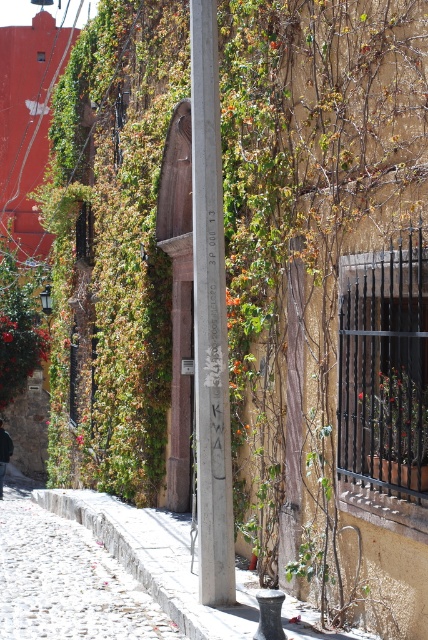
Can you confirm if white cobblestone at lower left is taller than green leafy plant at center?

Indeed, white cobblestone at lower left has a greater height compared to green leafy plant at center.

Is white cobblestone at lower left smaller than green leafy plant at center?

No, white cobblestone at lower left is not smaller than green leafy plant at center.

This screenshot has height=640, width=428. What do you see at coordinates (67, 580) in the screenshot?
I see `white cobblestone at lower left` at bounding box center [67, 580].

The image size is (428, 640). I want to click on white cobblestone at lower left, so click(x=67, y=580).

Can you confirm if smooth gray pole at center is thinner than white cobblestone at lower left?

Indeed, smooth gray pole at center has a lesser width compared to white cobblestone at lower left.

Is smooth gray pole at center to the left of white cobblestone at lower left from the viewer's perspective?

In fact, smooth gray pole at center is to the right of white cobblestone at lower left.

Between point (196, 102) and point (103, 563), which one is positioned behind?

The point (103, 563) is behind.

This screenshot has height=640, width=428. I want to click on smooth gray pole at center, so click(210, 317).

Is smooth gray pole at center shorter than green leafy plant at center?

Incorrect, smooth gray pole at center's height does not fall short of green leafy plant at center's.

Which is more to the left, smooth gray pole at center or green leafy plant at center?

Positioned to the left is smooth gray pole at center.

Find the location of a particular element. smooth gray pole at center is located at coordinates (210, 317).